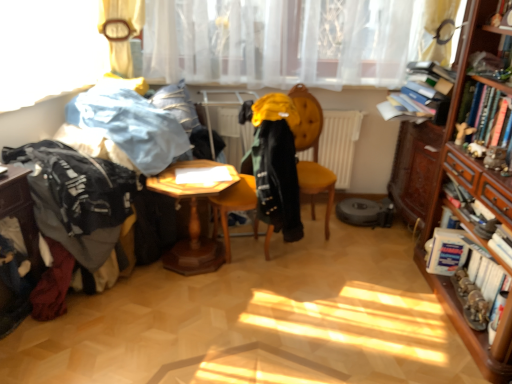
You are a GUI agent. You are given a task and a screenshot of the screen. Output one action in this format:
    pyautogui.click(x=<x>, y=<y>)
    Task: Click on the free space above wooden hexagonal table at center, marked as the second table in a left-to-right arrangement (from a real-world perspective)
    
    Given the screenshot: What is the action you would take?
    pyautogui.click(x=196, y=179)